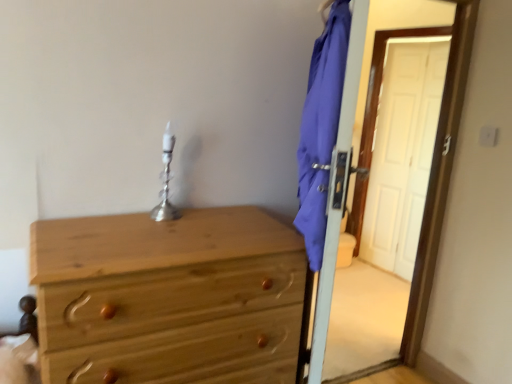
Question: From a real-world perspective, is natural wood chest of drawers at left over silver metallic table lamp at center?

Choices:
 (A) yes
 (B) no

Answer: (B)

Question: Can you confirm if natural wood chest of drawers at left is wider than silver metallic table lamp at center?

Choices:
 (A) no
 (B) yes

Answer: (B)

Question: Does natural wood chest of drawers at left come behind silver metallic table lamp at center?

Choices:
 (A) yes
 (B) no

Answer: (B)

Question: Considering the relative sizes of natural wood chest of drawers at left and silver metallic table lamp at center in the image provided, is natural wood chest of drawers at left bigger than silver metallic table lamp at center?

Choices:
 (A) no
 (B) yes

Answer: (B)

Question: From a real-world perspective, is natural wood chest of drawers at left physically below silver metallic table lamp at center?

Choices:
 (A) no
 (B) yes

Answer: (B)

Question: Considering the relative sizes of natural wood chest of drawers at left and silver metallic table lamp at center in the image provided, is natural wood chest of drawers at left taller than silver metallic table lamp at center?

Choices:
 (A) no
 (B) yes

Answer: (B)

Question: Does natural wood chest of drawers at left appear on the left side of blue fabric screen door at right?

Choices:
 (A) no
 (B) yes

Answer: (B)

Question: Can you confirm if natural wood chest of drawers at left is smaller than blue fabric screen door at right?

Choices:
 (A) no
 (B) yes

Answer: (A)

Question: From the image's perspective, would you say natural wood chest of drawers at left is shown under blue fabric screen door at right?

Choices:
 (A) no
 (B) yes

Answer: (B)

Question: Is the depth of natural wood chest of drawers at left greater than that of blue fabric screen door at right?

Choices:
 (A) yes
 (B) no

Answer: (B)

Question: Could you tell me if natural wood chest of drawers at left is facing blue fabric screen door at right?

Choices:
 (A) no
 (B) yes

Answer: (A)

Question: From a real-world perspective, is natural wood chest of drawers at left positioned under blue fabric screen door at right based on gravity?

Choices:
 (A) yes
 (B) no

Answer: (A)

Question: From a real-world perspective, is blue fabric screen door at right positioned over silver metallic table lamp at center based on gravity?

Choices:
 (A) no
 (B) yes

Answer: (A)